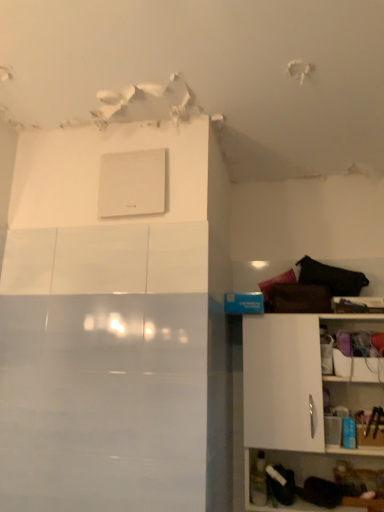
Question: Does white matte cabinet at right have a lesser width compared to white matte switch at upper center?

Choices:
 (A) no
 (B) yes

Answer: (A)

Question: Is there a large distance between white matte cabinet at right and white matte switch at upper center?

Choices:
 (A) yes
 (B) no

Answer: (B)

Question: Considering the relative sizes of white matte cabinet at right and white matte switch at upper center in the image provided, is white matte cabinet at right taller than white matte switch at upper center?

Choices:
 (A) yes
 (B) no

Answer: (A)

Question: From a real-world perspective, is white matte cabinet at right over white matte switch at upper center?

Choices:
 (A) yes
 (B) no

Answer: (B)

Question: Can you confirm if white matte cabinet at right is positioned to the left of white matte switch at upper center?

Choices:
 (A) no
 (B) yes

Answer: (A)

Question: Considering the relative sizes of white matte cabinet at right and white matte switch at upper center in the image provided, is white matte cabinet at right wider than white matte switch at upper center?

Choices:
 (A) no
 (B) yes

Answer: (B)

Question: From the image's perspective, is white matte switch at upper center on top of white matte cabinet at right?

Choices:
 (A) no
 (B) yes

Answer: (B)

Question: Is white matte switch at upper center facing away from white matte cabinet at right?

Choices:
 (A) yes
 (B) no

Answer: (B)

Question: Is white matte switch at upper center far from white matte cabinet at right?

Choices:
 (A) no
 (B) yes

Answer: (A)

Question: Could white matte cabinet at right be considered to be inside white matte switch at upper center?

Choices:
 (A) no
 (B) yes

Answer: (A)

Question: From a real-world perspective, is white matte switch at upper center beneath white matte cabinet at right?

Choices:
 (A) no
 (B) yes

Answer: (A)

Question: Is white matte switch at upper center placed right next to white matte cabinet at right?

Choices:
 (A) no
 (B) yes

Answer: (A)

Question: Is white matte switch at upper center taller or shorter than white matte cabinet at right?

Choices:
 (A) tall
 (B) short

Answer: (B)